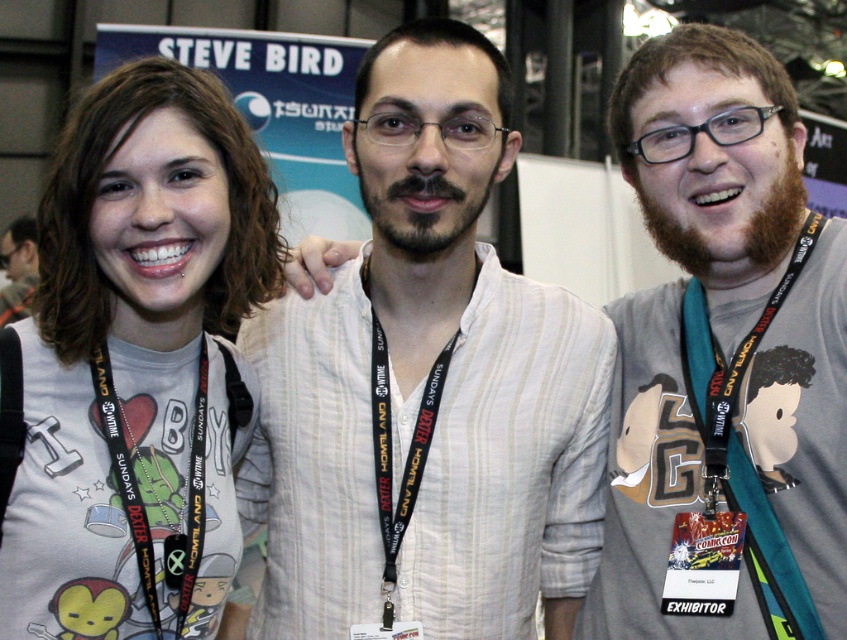
Looking at this image, is white matte t-shirt at center taller than beige fabric shirt at center?

In fact, white matte t-shirt at center may be shorter than beige fabric shirt at center.

How far apart are white matte t-shirt at center and beige fabric shirt at center?

white matte t-shirt at center is 27.82 inches away from beige fabric shirt at center.

Is point (92, 444) in front of point (707, 134)?

Yes, it is in front of point (707, 134).

At what (x,y) coordinates should I click in order to perform the action: click on white matte t-shirt at center. Please return your answer as a coordinate pair (x, y). The width and height of the screenshot is (847, 640). Looking at the image, I should click on (137, 364).

Is white matte t-shirt at center smaller than matte white shirt at center?

Indeed, white matte t-shirt at center has a smaller size compared to matte white shirt at center.

Is white matte t-shirt at center positioned before matte white shirt at center?

Yes, it is in front of matte white shirt at center.

Is point (70, 554) farther from viewer compared to point (3, 237)?

No, it is in front of (3, 237).

Find the location of `white matte t-shirt at center`. white matte t-shirt at center is located at coordinates (137, 364).

Is point (513, 412) in front of point (36, 282)?

Yes, it is.

Does white striped shirt at center have a smaller size compared to matte white shirt at center?

Incorrect, white striped shirt at center is not smaller in size than matte white shirt at center.

Describe the element at coordinates (427, 385) in the screenshot. The image size is (847, 640). I see `white striped shirt at center` at that location.

This screenshot has width=847, height=640. Find the location of `white striped shirt at center`. white striped shirt at center is located at coordinates (427, 385).